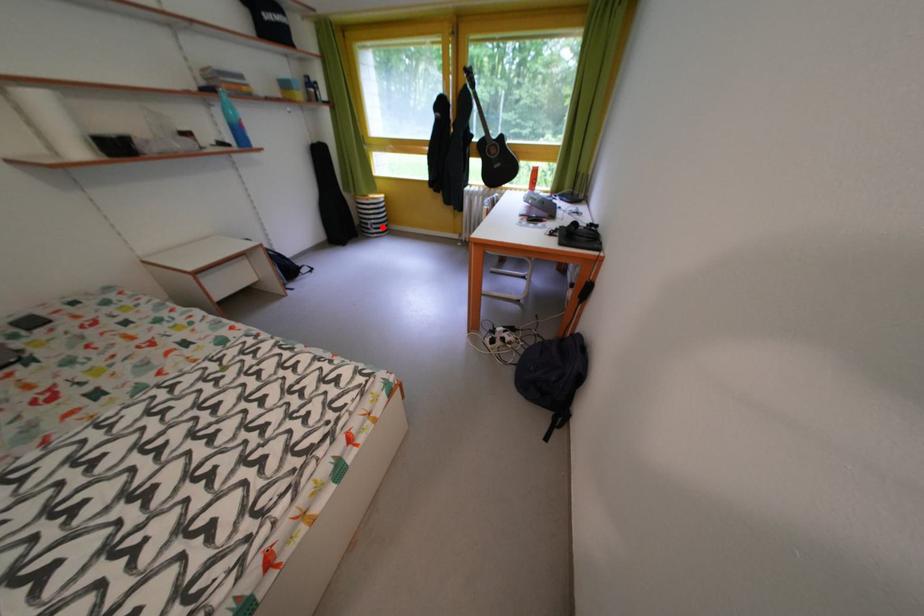
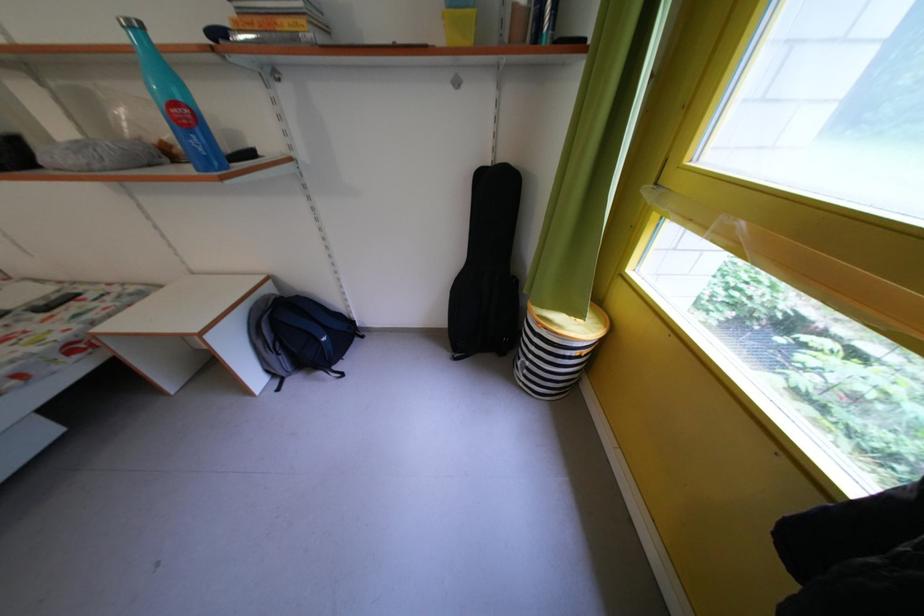
Question: I am providing you with two images of the same scene from different viewpoints. Image1 has a red point marked. In image2, the corresponding 3D location appears at what relative position? Reply with the corresponding letter.

Choices:
 (A) Closer
 (B) Farther

Answer: (B)